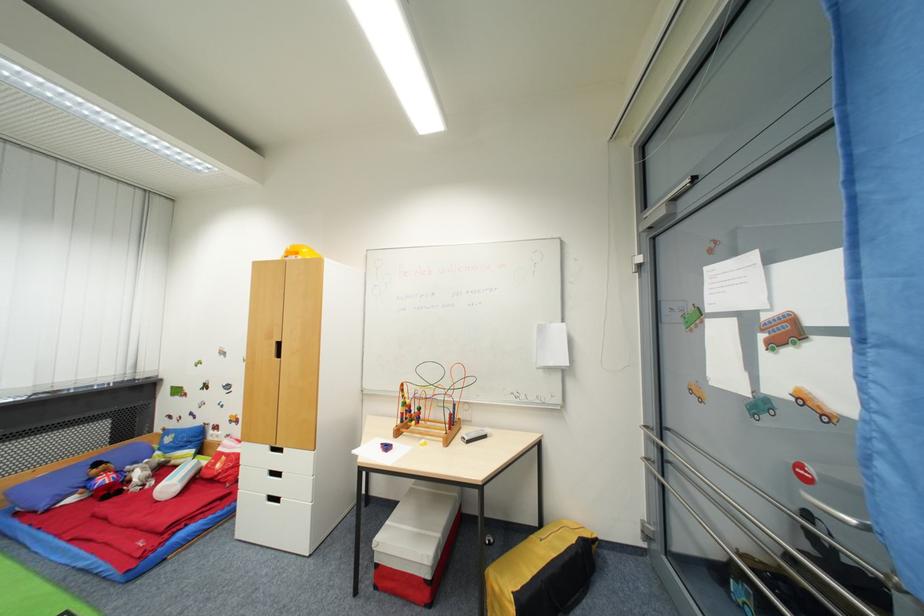
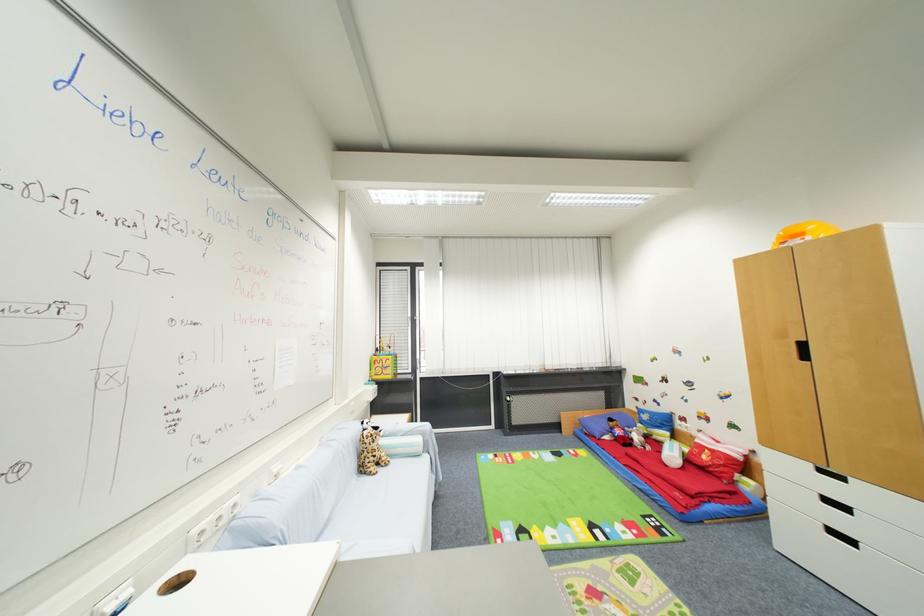
The point at (283, 501) is marked in the first image. Where is the corresponding point in the second image?

(857, 544)